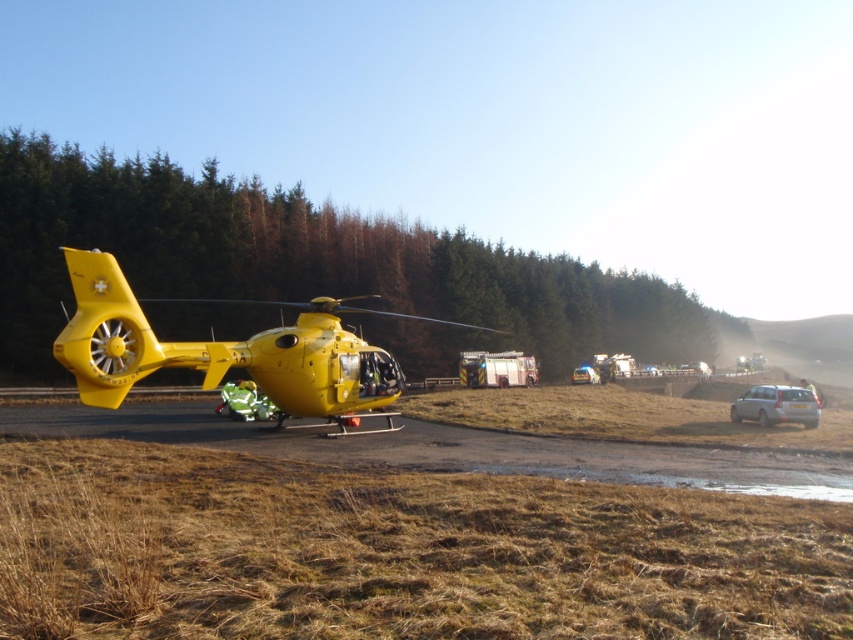
Is brown dirt track at lower center below silver metallic suv at right?

No.

Does brown dirt track at lower center have a lesser width compared to silver metallic suv at right?

Incorrect, brown dirt track at lower center's width is not less than silver metallic suv at right's.

The height and width of the screenshot is (640, 853). What do you see at coordinates (453, 449) in the screenshot?
I see `brown dirt track at lower center` at bounding box center [453, 449].

This screenshot has width=853, height=640. I want to click on brown dirt track at lower center, so click(x=453, y=449).

Is yellow matte helicopter at left thinner than silver metallic suv at right?

In fact, yellow matte helicopter at left might be wider than silver metallic suv at right.

Which is in front, point (265, 355) or point (801, 413)?

Point (265, 355) is more forward.

Where is `yellow matte helicopter at left`? This screenshot has width=853, height=640. yellow matte helicopter at left is located at coordinates (219, 352).

Which is above, brown dirt track at lower center or white glossy car at center?

Positioned higher is brown dirt track at lower center.

What do you see at coordinates (453, 449) in the screenshot?
I see `brown dirt track at lower center` at bounding box center [453, 449].

Measure the distance between point (837, 484) and camera.

A distance of 12.71 meters exists between point (837, 484) and camera.

The height and width of the screenshot is (640, 853). In order to click on brown dirt track at lower center in this screenshot , I will do `click(453, 449)`.